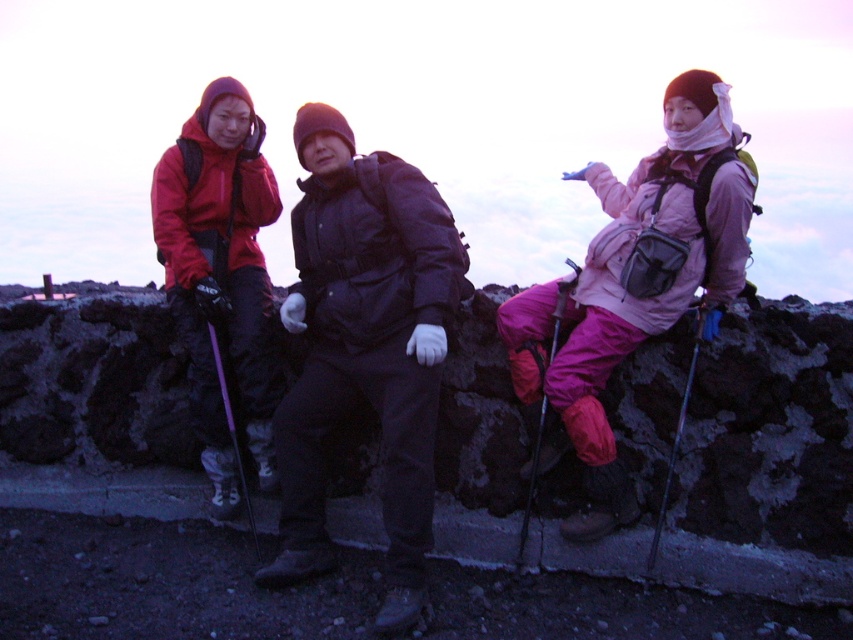
Does point (526, 504) come farther from viewer compared to point (251, 518)?

No, it is in front of (251, 518).

Is metallic silver ski pole at center thinner than purple plastic ski pole at center?

No.

Find the location of a particular element. This screenshot has width=853, height=640. metallic silver ski pole at center is located at coordinates (531, 481).

Is matte black jacket at center below metallic silver ski pole at center?

Actually, matte black jacket at center is above metallic silver ski pole at center.

Is matte black jacket at center positioned at the back of metallic silver ski pole at center?

No, matte black jacket at center is in front of metallic silver ski pole at center.

Where is `matte black jacket at center`? matte black jacket at center is located at coordinates (364, 348).

Consider the image. Can you confirm if matte black jacket at center is smaller than purple plastic ski pole at center?

Incorrect, matte black jacket at center is not smaller in size than purple plastic ski pole at center.

At what (x,y) coordinates should I click in order to perform the action: click on matte black jacket at center. Please return your answer as a coordinate pair (x, y). Image resolution: width=853 pixels, height=640 pixels. Looking at the image, I should click on (364, 348).

Where is `matte black jacket at center`? This screenshot has height=640, width=853. matte black jacket at center is located at coordinates (364, 348).